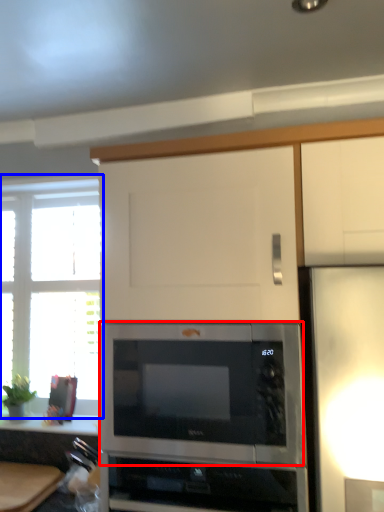
Question: Among these objects, which one is nearest to the camera, microwave oven (highlighted by a red box) or window (highlighted by a blue box)?

Choices:
 (A) microwave oven
 (B) window

Answer: (A)